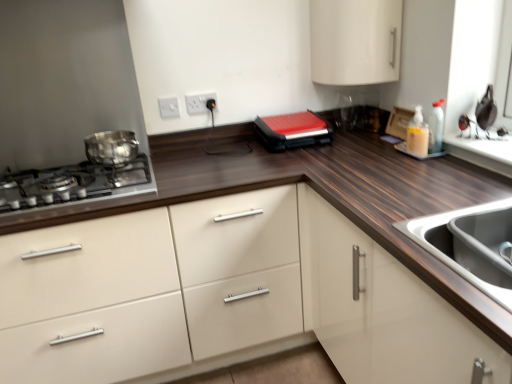
Question: In the image, is white glossy cabinet at upper center, arranged as the 1th cabinetry when viewed from the top, positioned in front of or behind stainless steel sink at lower right?

Choices:
 (A) front
 (B) behind

Answer: (B)

Question: Considering the positions of white glossy cabinet at upper center, placed as the 2th cabinetry when sorted from bottom to top, and stainless steel sink at lower right in the image, is white glossy cabinet at upper center, placed as the 2th cabinetry when sorted from bottom to top, wider or thinner than stainless steel sink at lower right?

Choices:
 (A) thin
 (B) wide

Answer: (A)

Question: Estimate the real-world distances between objects in this image. Which object is farther from the white plastic electric outlet at upper center, positioned as the first electric outlet in left-to-right order?

Choices:
 (A) translucent plastic soap dispenser at upper right
 (B) white plastic electric outlet at upper center, the second electric outlet when ordered from left to right
 (C) white glossy cabinet at center, which ranks as the 1th cabinetry in bottom-to-top order
 (D) shiny metallic pot at left
 (E) red matte sandwich maker at center

Answer: (A)

Question: Estimate the real-world distances between objects in this image. Which object is farther from the white plastic electric outlet at upper center, positioned as the 2th electric outlet in right-to-left order?

Choices:
 (A) stainless steel sink at lower right
 (B) white glossy cabinet at center, the 2th cabinetry viewed from the top
 (C) white plastic electric outlet at upper center, which is counted as the 1th electric outlet, starting from the right
 (D) shiny metallic gas stove at left
 (E) white glossy cabinet at upper center, arranged as the 1th cabinetry when viewed from the top

Answer: (A)